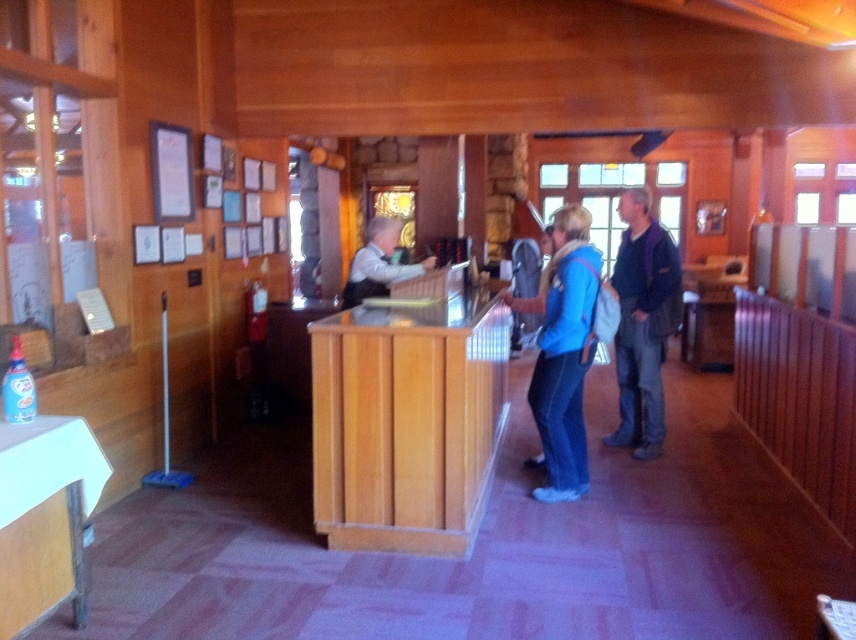
Does blue fabric backpack at center have a greater width compared to matte black vest at center?

In fact, blue fabric backpack at center might be narrower than matte black vest at center.

Does blue fabric backpack at center appear on the left side of matte black vest at center?

In fact, blue fabric backpack at center is to the right of matte black vest at center.

Where is `blue fabric backpack at center`? This screenshot has width=856, height=640. blue fabric backpack at center is located at coordinates (563, 353).

In the scene shown: Can you confirm if dark blue sweater at center is bigger than matte black vest at center?

Indeed, dark blue sweater at center has a larger size compared to matte black vest at center.

Is dark blue sweater at center further to camera compared to matte black vest at center?

Yes, dark blue sweater at center is further from the viewer.

The height and width of the screenshot is (640, 856). What do you see at coordinates (643, 323) in the screenshot? I see `dark blue sweater at center` at bounding box center [643, 323].

Locate an element on the screen. This screenshot has width=856, height=640. dark blue sweater at center is located at coordinates (643, 323).

Can you confirm if blue fabric backpack at center is bigger than dark blue sweater at center?

Incorrect, blue fabric backpack at center is not larger than dark blue sweater at center.

Is blue fabric backpack at center in front of dark blue sweater at center?

Yes, blue fabric backpack at center is in front of dark blue sweater at center.

Who is more forward, (584, 316) or (622, 310)?

Point (584, 316) is in front.

Identify the location of blue fabric backpack at center. The width and height of the screenshot is (856, 640). (563, 353).